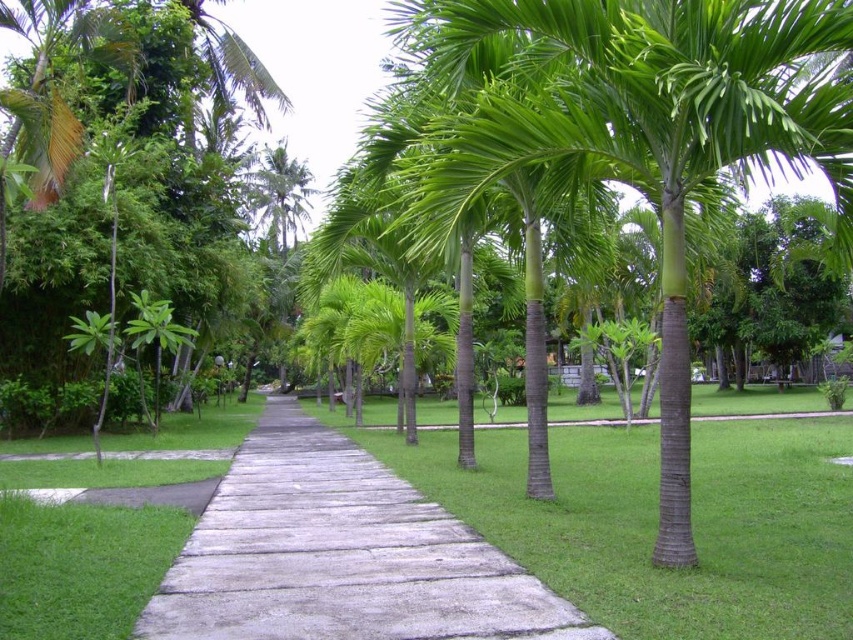
Is point (631, 547) farther from camera compared to point (210, 536)?

No, it is not.

Is green grass at center positioned behind gray concrete pavement at center?

No, green grass at center is closer to the viewer.

Is point (816, 621) positioned before point (206, 531)?

Yes, point (816, 621) is in front of point (206, 531).

The image size is (853, 640). I want to click on green grass at center, so click(656, 522).